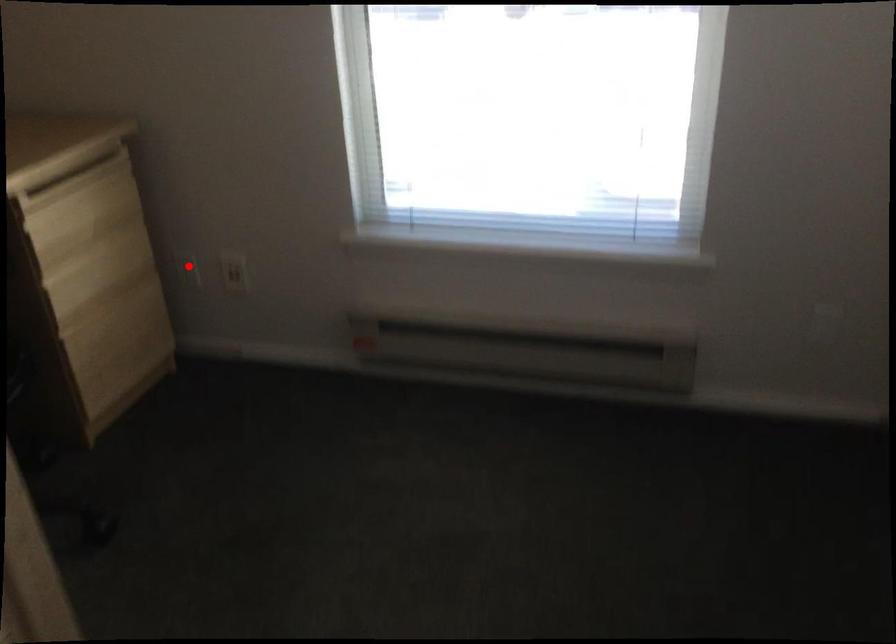
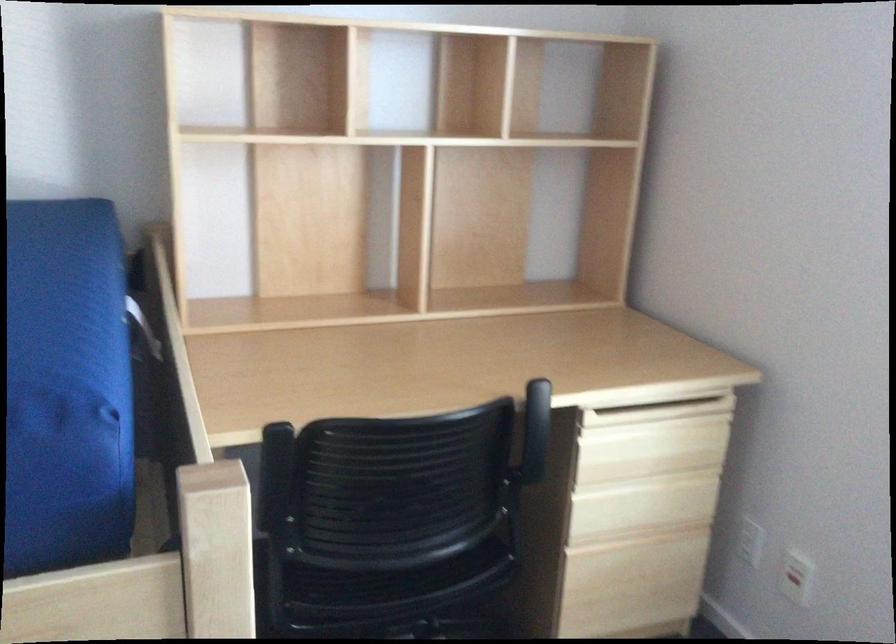
Locate, in the second image, the point that corresponds to the highlighted location in the first image.

(750, 541)